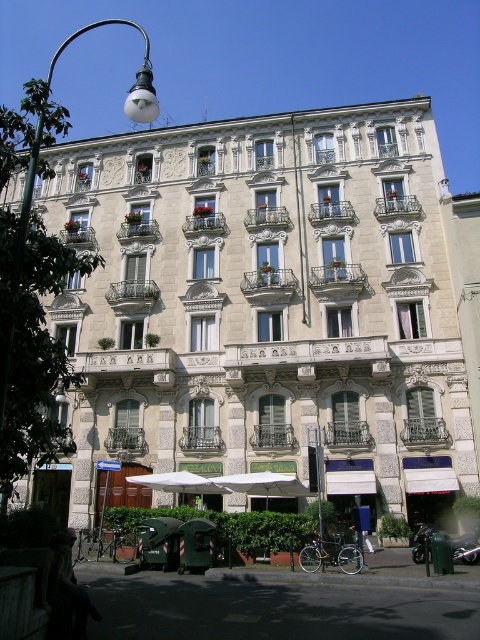
Question: Considering the relative positions of white stone building at center and metallic streetlamp at left in the image provided, where is white stone building at center located with respect to metallic streetlamp at left?

Choices:
 (A) right
 (B) left

Answer: (A)

Question: Does white stone building at center have a larger size compared to metallic streetlamp at left?

Choices:
 (A) yes
 (B) no

Answer: (B)

Question: Is white stone building at center below metallic streetlamp at left?

Choices:
 (A) no
 (B) yes

Answer: (B)

Question: Which point is closer to the camera taking this photo?

Choices:
 (A) (151, 388)
 (B) (149, 112)

Answer: (B)

Question: Among these objects, which one is nearest to the camera?

Choices:
 (A) metallic streetlamp at left
 (B) white stone building at center

Answer: (A)